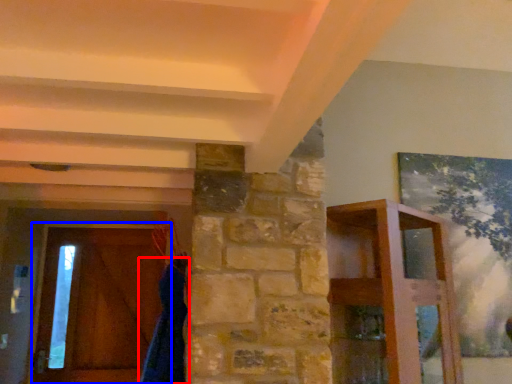
Question: Which of the following is the closest to the observer, robe (highlighted by a red box) or barn door (highlighted by a blue box)?

Choices:
 (A) robe
 (B) barn door

Answer: (A)